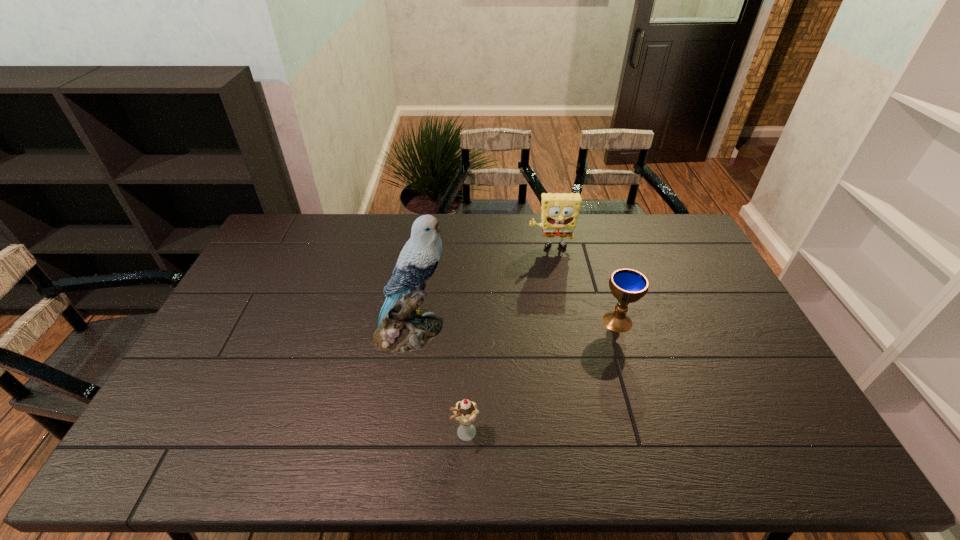
Locate an element on the screen. parakeet is located at coordinates (403, 326).

Image resolution: width=960 pixels, height=540 pixels. Identify the location of the leftmost object. (403, 326).

Locate an element on the screen. the farthest object is located at coordinates (559, 214).

Find the location of a particular element. Image resolution: width=960 pixels, height=540 pixels. the third object from left to right is located at coordinates (559, 214).

Where is `the rightmost object`? Image resolution: width=960 pixels, height=540 pixels. the rightmost object is located at coordinates (627, 285).

I want to click on icecream, so click(x=465, y=412).

Locate an element on the screen. The image size is (960, 540). the second object from left to right is located at coordinates (465, 412).

You are a GUI agent. You are given a task and a screenshot of the screen. Output one action in this format:
    pyautogui.click(x=<x>, y=<y>)
    Task: Click on the vacant space situated 0.140m on the face of the leftmost object
    
    Given the screenshot: What is the action you would take?
    pyautogui.click(x=494, y=330)

The height and width of the screenshot is (540, 960). I want to click on vacant point located on the face of the third object from left to right, so click(559, 292).

You are a GUI agent. You are given a task and a screenshot of the screen. Output one action in this format:
    pyautogui.click(x=<x>, y=<y>)
    Task: Click on the vacant region located on the left of the rightmost object
    
    Given the screenshot: What is the action you would take?
    pyautogui.click(x=541, y=321)